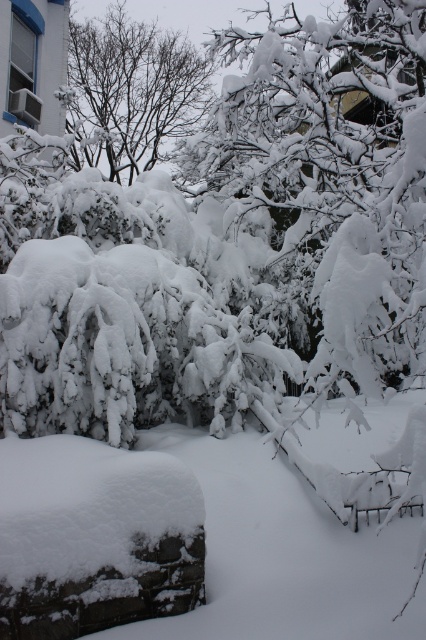
Is white fluffy snow at center above snow-covered branches at upper center?

Incorrect, white fluffy snow at center is not positioned above snow-covered branches at upper center.

Looking at this image, which is more to the right, white fluffy snow at center or snow-covered branches at upper center?

From the viewer's perspective, white fluffy snow at center appears more on the right side.

Find the location of a particular element. white fluffy snow at center is located at coordinates (284, 554).